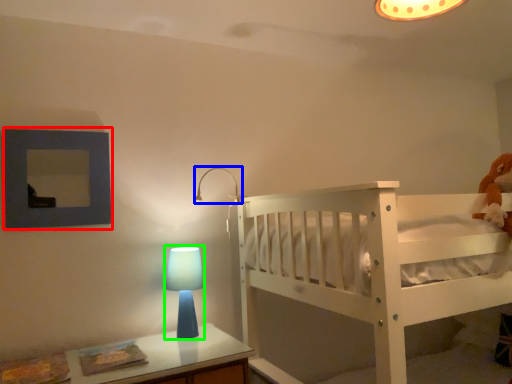
Question: Estimate the real-world distances between objects in this image. Which object is farther from picture frame (highlighted by a red box), lamp (highlighted by a blue box) or table lamp (highlighted by a green box)?

Choices:
 (A) lamp
 (B) table lamp

Answer: (A)